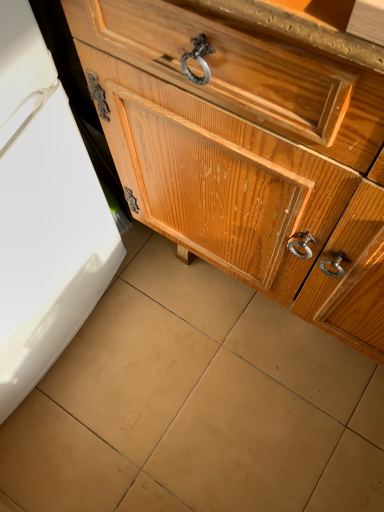
Question: From the image's perspective, is brown matte tile at center above or below glossy wood chest of drawers at center?

Choices:
 (A) above
 (B) below

Answer: (B)

Question: Considering the positions of brown matte tile at center and glossy wood chest of drawers at center in the image, is brown matte tile at center bigger or smaller than glossy wood chest of drawers at center?

Choices:
 (A) big
 (B) small

Answer: (B)

Question: Is brown matte tile at center in front of or behind glossy wood chest of drawers at center in the image?

Choices:
 (A) front
 (B) behind

Answer: (B)

Question: Based on their positions, is glossy wood chest of drawers at center located to the left or right of brown matte tile at center?

Choices:
 (A) left
 (B) right

Answer: (B)

Question: Would you say glossy wood chest of drawers at center is inside or outside brown matte tile at center?

Choices:
 (A) outside
 (B) inside

Answer: (A)

Question: From the image's perspective, is glossy wood chest of drawers at center above or below brown matte tile at center?

Choices:
 (A) above
 (B) below

Answer: (A)

Question: From a real-world perspective, is glossy wood chest of drawers at center physically located above or below brown matte tile at center?

Choices:
 (A) above
 (B) below

Answer: (A)